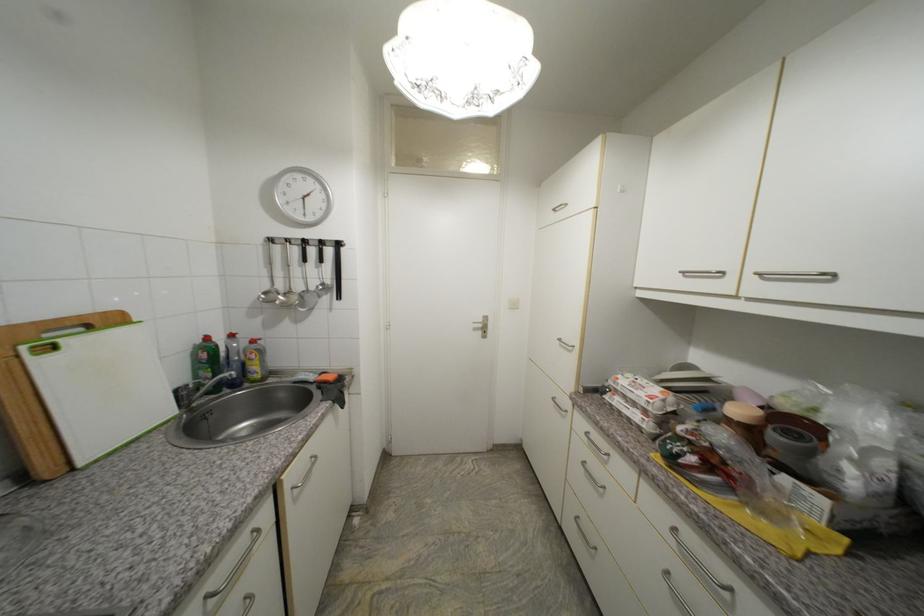
Where would you turn the white door handle? Please return your answer as a coordinate pair (x, y).

(487, 326)